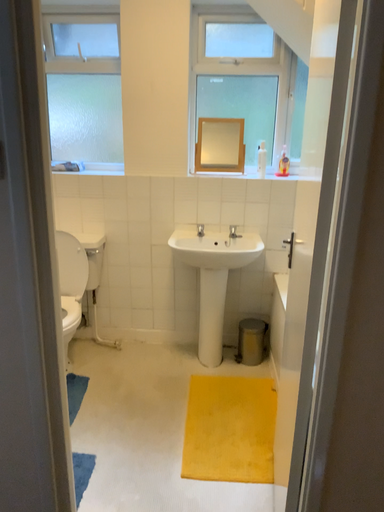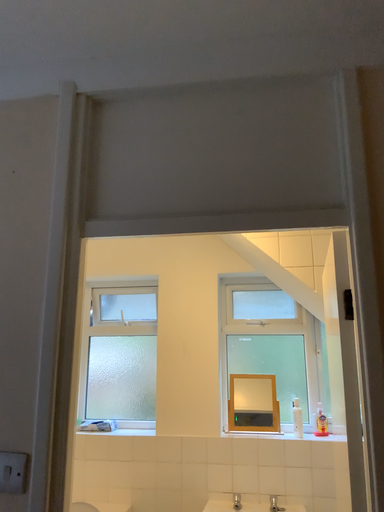
Question: How did the camera likely rotate when shooting the video?

Choices:
 (A) rotated downward
 (B) rotated upward

Answer: (B)